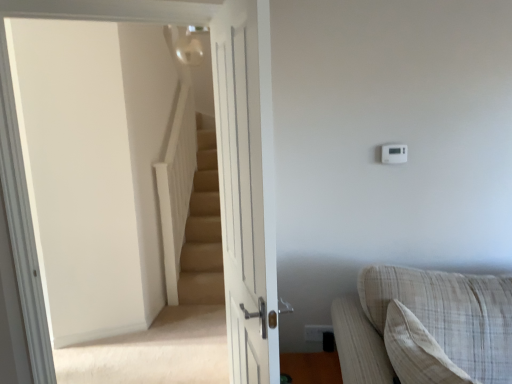
Question: Does white plastic thermostat at upper right come behind white wooden door at center?

Choices:
 (A) yes
 (B) no

Answer: (A)

Question: From the image's perspective, is white plastic thermostat at upper right beneath white wooden door at center?

Choices:
 (A) yes
 (B) no

Answer: (B)

Question: Is white plastic thermostat at upper right bigger than white wooden door at center?

Choices:
 (A) no
 (B) yes

Answer: (A)

Question: Is white plastic thermostat at upper right completely or partially outside of white wooden door at center?

Choices:
 (A) yes
 (B) no

Answer: (A)

Question: From a real-world perspective, does white plastic thermostat at upper right sit lower than white wooden door at center?

Choices:
 (A) no
 (B) yes

Answer: (A)

Question: Considering the positions of white plastic thermostat at upper right and beige carpeted stairs at upper left in the image, is white plastic thermostat at upper right bigger or smaller than beige carpeted stairs at upper left?

Choices:
 (A) big
 (B) small

Answer: (B)

Question: Based on their positions, is white plastic thermostat at upper right located to the left or right of beige carpeted stairs at upper left?

Choices:
 (A) right
 (B) left

Answer: (A)

Question: From a real-world perspective, is white plastic thermostat at upper right physically located above or below beige carpeted stairs at upper left?

Choices:
 (A) above
 (B) below

Answer: (A)

Question: Which is correct: white plastic thermostat at upper right is inside beige carpeted stairs at upper left, or outside of it?

Choices:
 (A) inside
 (B) outside

Answer: (B)

Question: Considering the relative positions of beige fabric couch at lower right and beige carpeted stairs at upper left in the image provided, is beige fabric couch at lower right to the left or to the right of beige carpeted stairs at upper left?

Choices:
 (A) left
 (B) right

Answer: (B)

Question: Is beige fabric couch at lower right situated inside beige carpeted stairs at upper left or outside?

Choices:
 (A) outside
 (B) inside

Answer: (A)

Question: Is beige fabric couch at lower right wider or thinner than beige carpeted stairs at upper left?

Choices:
 (A) thin
 (B) wide

Answer: (B)

Question: From the image's perspective, is beige fabric couch at lower right positioned above or below beige carpeted stairs at upper left?

Choices:
 (A) below
 (B) above

Answer: (A)

Question: Visually, is white plastic electric outlet at upper right positioned to the left or to the right of beige carpeted stairs at upper left?

Choices:
 (A) right
 (B) left

Answer: (A)

Question: Looking at the image, does white plastic electric outlet at upper right seem bigger or smaller compared to beige carpeted stairs at upper left?

Choices:
 (A) big
 (B) small

Answer: (B)